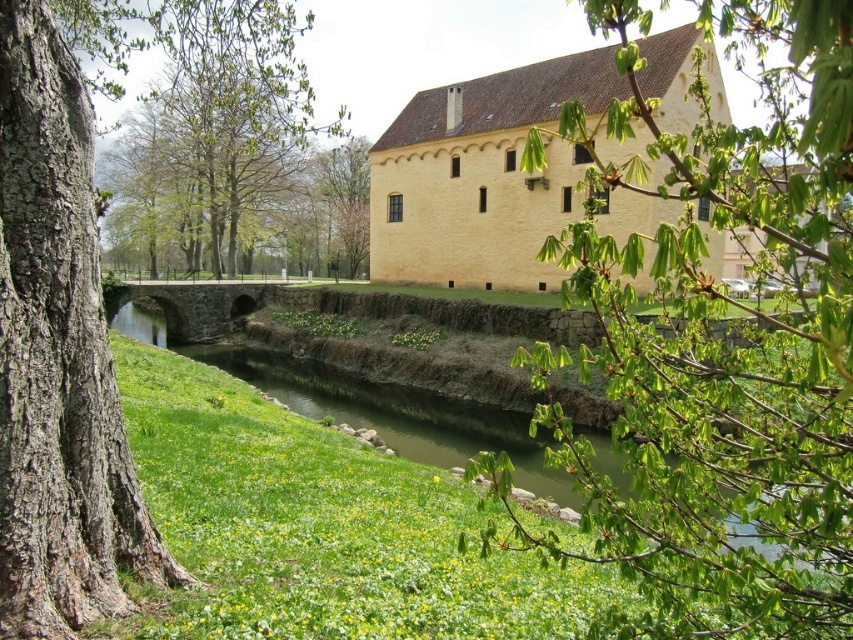
You are standing in front of the large pale yellow stone building and notice two trees in the scene. The smooth bark tree at left and the green leafy tree at upper center. Which tree is positioned lower in the image?

The smooth bark tree at left is positioned lower than the green leafy tree at upper center.

You are standing at the entrance of the pale yellow stone building and looking towards the arched stone bridge. There is a point marked at coordinates point (727, 344). What object does this point correspond to?

The point (727, 344) corresponds to the green leafy branch at upper right.